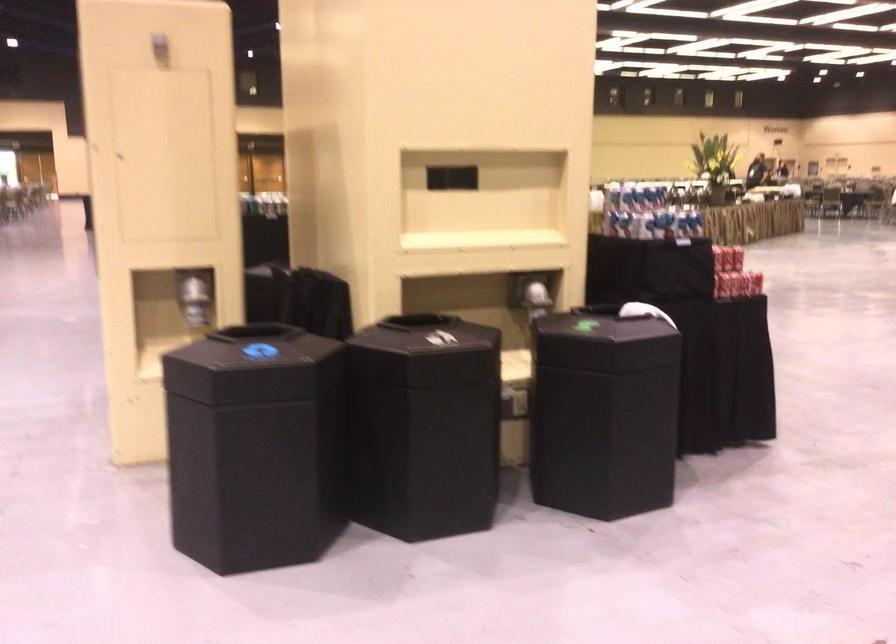
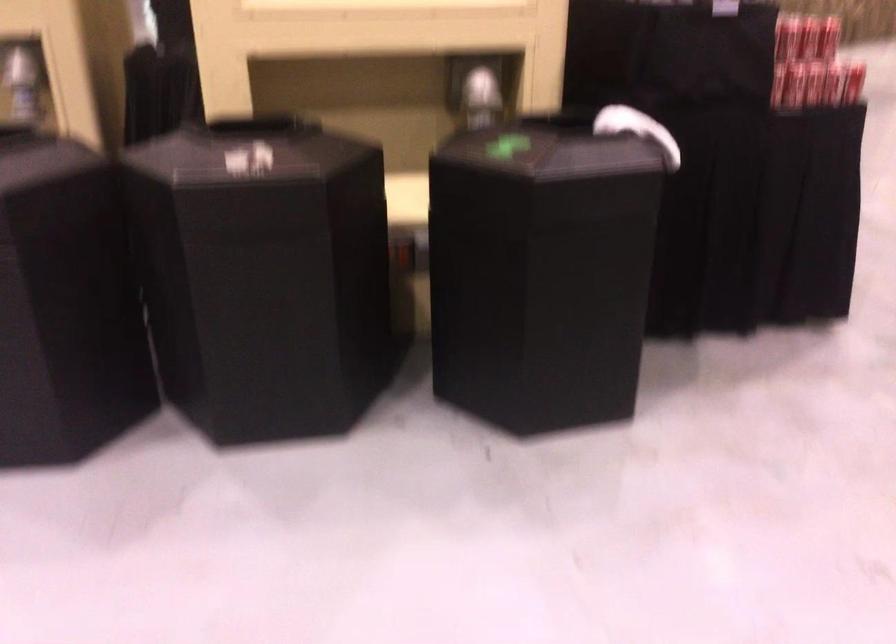
Where in the second image is the point corresponding to point 734,285 from the first image?

(788, 84)